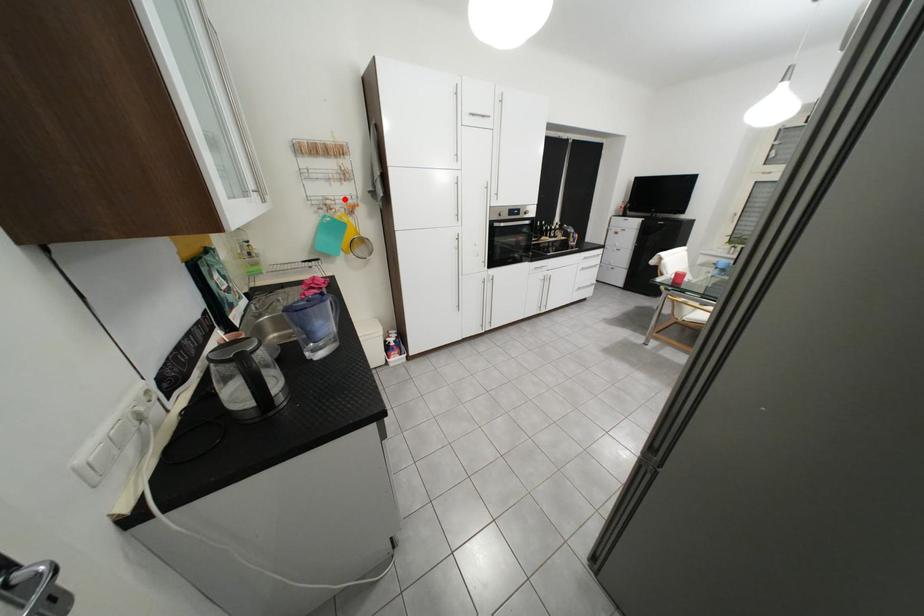
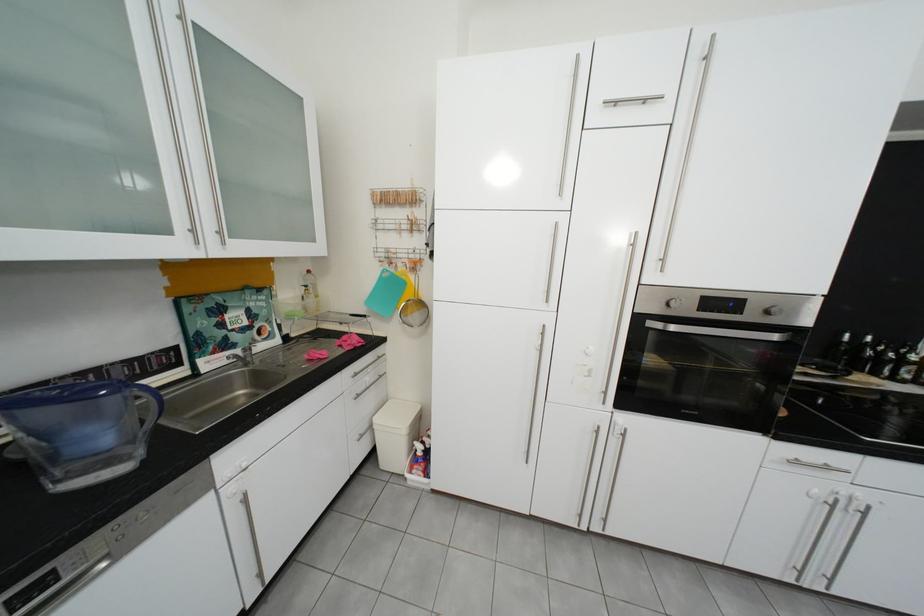
Question: A red point is marked in image1. In image2, is the corresponding 3D point closer to the camera or farther? Reply with the corresponding letter.

Choices:
 (A) The corresponding 3D point is closer.
 (B) The corresponding 3D point is farther.

Answer: (B)